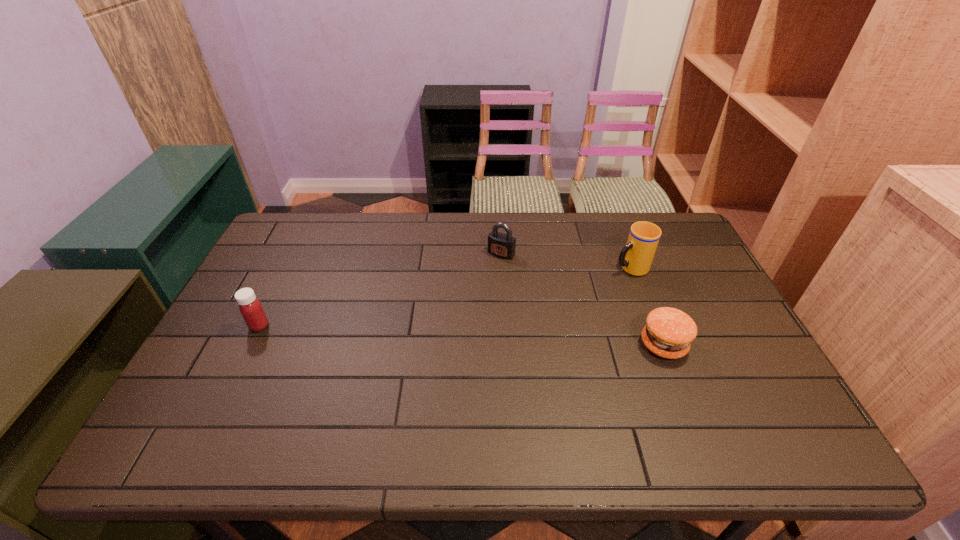
The image size is (960, 540). I want to click on free space between the padlock and the patty, so click(x=583, y=299).

Where is `free space that is in between the padlock and the medicine`? The height and width of the screenshot is (540, 960). free space that is in between the padlock and the medicine is located at coordinates (380, 289).

Identify the location of vacant area between the leftmost object and the padlock. The width and height of the screenshot is (960, 540). (380, 289).

This screenshot has height=540, width=960. What are the coordinates of `unoccupied area between the second object from left to right and the medicine` in the screenshot? It's located at (380, 289).

The image size is (960, 540). Identify the location of vacant space in between the tallest object and the leftmost object. (444, 296).

The image size is (960, 540). Find the location of `vacant space that's between the tallest object and the patty`. vacant space that's between the tallest object and the patty is located at coordinates (647, 306).

Where is `empty space between the leftmost object and the tallest object`? This screenshot has height=540, width=960. empty space between the leftmost object and the tallest object is located at coordinates (444, 296).

Where is `vacant space that is in between the padlock and the medicine`? The width and height of the screenshot is (960, 540). vacant space that is in between the padlock and the medicine is located at coordinates (380, 289).

The width and height of the screenshot is (960, 540). Identify the location of free point between the patty and the second object from left to right. (583, 299).

Locate an element on the screen. The height and width of the screenshot is (540, 960). vacant area that lies between the padlock and the medicine is located at coordinates (380, 289).